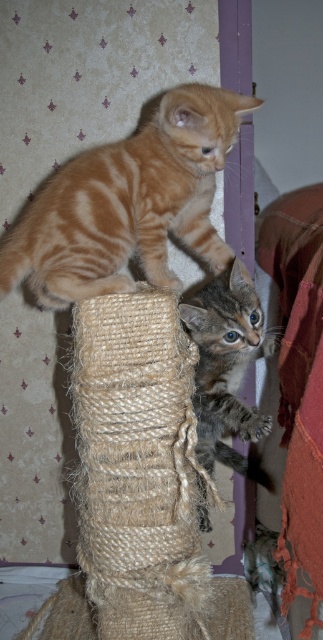
The height and width of the screenshot is (640, 323). Describe the element at coordinates (128, 204) in the screenshot. I see `orange striped kitten at upper left` at that location.

Who is lower down, orange striped kitten at upper left or tabby fur cat at center?

tabby fur cat at center is lower down.

Who is more distant from viewer, (191,212) or (237,316)?

The point (191,212) is more distant.

Where is `orange striped kitten at upper left`? orange striped kitten at upper left is located at coordinates (128, 204).